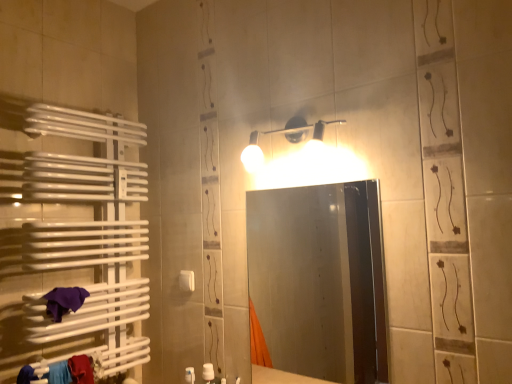
Question: From their relative heights in the image, would you say white plastic towel bar at lower left is taller or shorter than smooth glass mirror at center?

Choices:
 (A) short
 (B) tall

Answer: (A)

Question: Is white plastic towel bar at lower left inside the boundaries of smooth glass mirror at center, or outside?

Choices:
 (A) inside
 (B) outside

Answer: (B)

Question: Estimate the real-world distances between objects in this image. Which object is farther from the matte white light fixture at upper center?

Choices:
 (A) smooth glass mirror at center
 (B) white plastic towel bar at lower left
 (C) purple cloth at lower left

Answer: (A)

Question: Based on their relative distances, which object is farther from the smooth glass mirror at center?

Choices:
 (A) white plastic towel bar at lower left
 (B) purple cloth at lower left
 (C) matte white light fixture at upper center

Answer: (B)